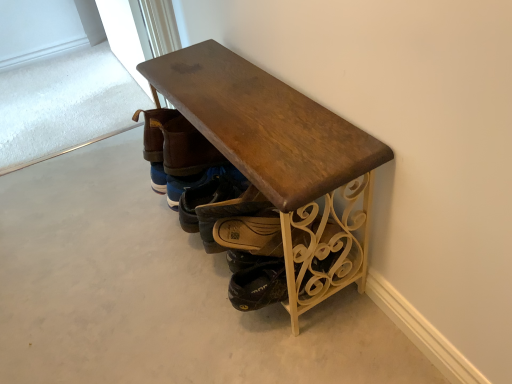
Question: Can you confirm if brown leather shoe at center, acting as the 2th footwear starting from the back, is positioned to the right of brown leather boot at center, which is the fourth footwear in front-to-back order?

Choices:
 (A) yes
 (B) no

Answer: (A)

Question: Is the depth of brown leather shoe at center, acting as the 3th footwear starting from the front, greater than that of brown leather boot at center, which is the fourth footwear in front-to-back order?

Choices:
 (A) no
 (B) yes

Answer: (A)

Question: Does brown leather shoe at center, acting as the 3th footwear starting from the front, turn towards brown leather boot at center, arranged as the first footwear when viewed from the back?

Choices:
 (A) yes
 (B) no

Answer: (B)

Question: Is brown leather shoe at center, acting as the 2th footwear starting from the back, directly adjacent to brown leather boot at center, which is the fourth footwear in front-to-back order?

Choices:
 (A) yes
 (B) no

Answer: (B)

Question: Is brown leather shoe at center, acting as the 3th footwear starting from the front, not close to brown leather boot at center, which is the fourth footwear in front-to-back order?

Choices:
 (A) yes
 (B) no

Answer: (B)

Question: In the image, is brown leather shoe at center, acting as the 2th footwear starting from the back, on the left side or the right side of brown leather shoes at center, acting as the first footwear starting from the front?

Choices:
 (A) right
 (B) left

Answer: (B)

Question: From their relative heights in the image, would you say brown leather shoe at center, acting as the 2th footwear starting from the back, is taller or shorter than brown leather shoes at center, acting as the first footwear starting from the front?

Choices:
 (A) short
 (B) tall

Answer: (A)

Question: Is brown leather shoe at center, acting as the 3th footwear starting from the front, in front of or behind brown leather shoes at center, acting as the first footwear starting from the front, in the image?

Choices:
 (A) behind
 (B) front

Answer: (A)

Question: Is point (x=199, y=185) closer or farther from the camera than point (x=199, y=178)?

Choices:
 (A) farther
 (B) closer

Answer: (B)

Question: Considering the positions of point (168, 117) and point (148, 120), is point (168, 117) closer or farther from the camera than point (148, 120)?

Choices:
 (A) farther
 (B) closer

Answer: (B)

Question: From the image's perspective, relative to brown leather shoes at center, marked as the 4th footwear in a back-to-front arrangement, is brown leather boot at center, arranged as the first footwear when viewed from the back, above or below?

Choices:
 (A) above
 (B) below

Answer: (A)

Question: Is brown leather boot at center, which is the fourth footwear in front-to-back order, wider or thinner than brown leather shoes at center, acting as the first footwear starting from the front?

Choices:
 (A) thin
 (B) wide

Answer: (A)

Question: Choose the correct answer: Is brown leather boot at center, which is the fourth footwear in front-to-back order, inside brown leather shoes at center, acting as the first footwear starting from the front, or outside it?

Choices:
 (A) outside
 (B) inside

Answer: (B)

Question: Is brown leather boot at center, which is the fourth footwear in front-to-back order, bigger or smaller than brown leather shoe at center, acting as the 3th footwear starting from the front?

Choices:
 (A) small
 (B) big

Answer: (A)

Question: Would you say brown leather boot at center, arranged as the first footwear when viewed from the back, is inside or outside brown leather shoe at center, acting as the 2th footwear starting from the back?

Choices:
 (A) outside
 (B) inside

Answer: (A)